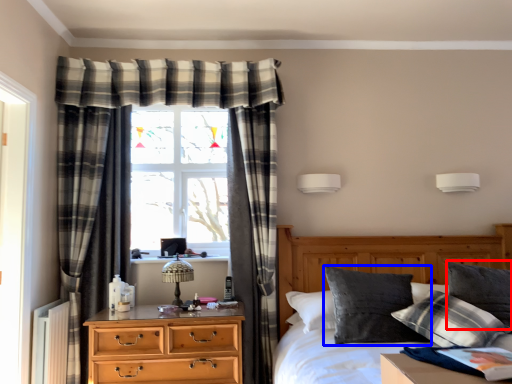
Question: Which point is further to the camera, pillow (highlighted by a red box) or pillow (highlighted by a blue box)?

Choices:
 (A) pillow
 (B) pillow

Answer: (A)